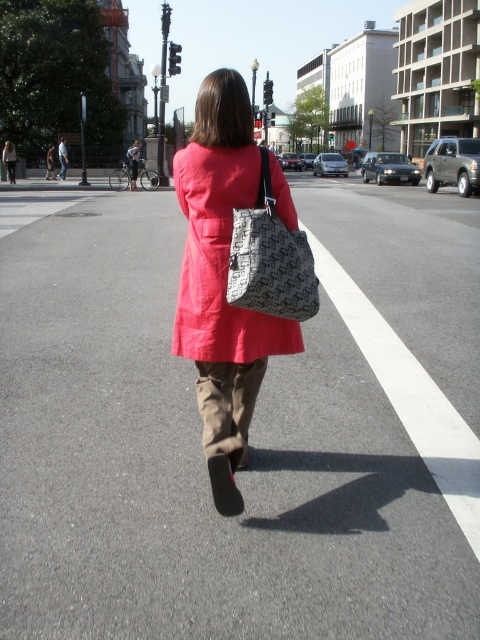
Question: Which object is the farthest from the cotton coat at center?

Choices:
 (A) matte pink coat at center
 (B) gray textured tote at center

Answer: (A)

Question: Among these objects, which one is nearest to the camera?

Choices:
 (A) cotton coat at center
 (B) matte pink coat at center

Answer: (B)

Question: Which point is farther from the camera taking this photo?

Choices:
 (A) (219, 282)
 (B) (255, 289)

Answer: (A)

Question: Does matte pink coat at center have a smaller size compared to gray textured tote at center?

Choices:
 (A) yes
 (B) no

Answer: (B)

Question: Is cotton coat at center wider than gray textured tote at center?

Choices:
 (A) yes
 (B) no

Answer: (A)

Question: Is cotton coat at center smaller than gray textured tote at center?

Choices:
 (A) yes
 (B) no

Answer: (B)